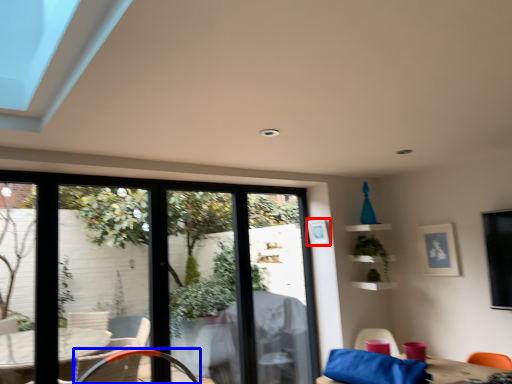
Question: Which point is closer to the camera, picture frame (highlighted by a red box) or chair (highlighted by a blue box)?

Choices:
 (A) picture frame
 (B) chair

Answer: (B)